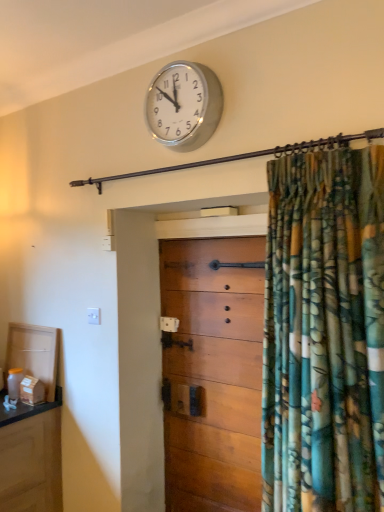
What is the approximate height of silver metallic clock at upper center?

33.89 centimeters.

This screenshot has height=512, width=384. What do you see at coordinates (184, 105) in the screenshot? I see `silver metallic clock at upper center` at bounding box center [184, 105].

Where is `silver metallic clock at upper center`? The width and height of the screenshot is (384, 512). silver metallic clock at upper center is located at coordinates (184, 105).

In order to face silver metallic clock at upper center, should I rotate leftwards or rightwards?

You should look left and rotate roughly 1.903 degrees.

Locate an element on the screen. This screenshot has width=384, height=512. wooden chest of drawers at center is located at coordinates (213, 373).

The height and width of the screenshot is (512, 384). What do you see at coordinates (213, 373) in the screenshot? I see `wooden chest of drawers at center` at bounding box center [213, 373].

Locate an element on the screen. Image resolution: width=384 pixels, height=512 pixels. silver metallic clock at upper center is located at coordinates (184, 105).

Would you say silver metallic clock at upper center is to the left or to the right of wooden chest of drawers at center in the picture?

In the image, silver metallic clock at upper center appears on the left side of wooden chest of drawers at center.

Looking at this image, which object is further away from the camera, silver metallic clock at upper center or wooden chest of drawers at center?

Positioned behind is wooden chest of drawers at center.

Is point (181, 85) farther from viewer compared to point (204, 472)?

No.

Consider the image. From the image's perspective, which is below, silver metallic clock at upper center or wooden chest of drawers at center?

wooden chest of drawers at center is shown below in the image.

From a real-world perspective, which is physically below, silver metallic clock at upper center or wooden chest of drawers at center?

From a 3D spatial view, wooden chest of drawers at center is below.

Based on the photo, can you confirm if silver metallic clock at upper center is thinner than wooden chest of drawers at center?

Yes, silver metallic clock at upper center is thinner than wooden chest of drawers at center.

Does silver metallic clock at upper center have a lesser height compared to wooden chest of drawers at center?

Indeed, silver metallic clock at upper center has a lesser height compared to wooden chest of drawers at center.

Considering the sizes of objects silver metallic clock at upper center and wooden chest of drawers at center in the image provided, who is bigger, silver metallic clock at upper center or wooden chest of drawers at center?

With larger size is wooden chest of drawers at center.

Is silver metallic clock at upper center completely or partially outside of wooden chest of drawers at center?

That's correct, silver metallic clock at upper center is outside of wooden chest of drawers at center.

Is silver metallic clock at upper center positioned far away from wooden chest of drawers at center?

No, silver metallic clock at upper center is in close proximity to wooden chest of drawers at center.

Is silver metallic clock at upper center oriented away from wooden chest of drawers at center?

No.

What's the angular difference between silver metallic clock at upper center and wooden chest of drawers at center's facing directions?

There is a 0.888-degree angle between the facing directions of silver metallic clock at upper center and wooden chest of drawers at center.

In the image, there is a wooden chest of drawers at center. Identify the location of wall clock above it (from the image's perspective). pyautogui.click(x=184, y=105).

Can you confirm if wooden chest of drawers at center is positioned to the right of silver metallic clock at upper center?

Yes.

Is wooden chest of drawers at center positioned before silver metallic clock at upper center?

No, the depth of wooden chest of drawers at center is greater than that of silver metallic clock at upper center.

Does point (181, 495) lie behind point (179, 100)?

Yes, it is behind point (179, 100).

From the image's perspective, between wooden chest of drawers at center and silver metallic clock at upper center, who is located below?

wooden chest of drawers at center appears lower in the image.

From a real-world perspective, who is located higher, wooden chest of drawers at center or silver metallic clock at upper center?

In real-world perspective, silver metallic clock at upper center is above.

Considering the relative sizes of wooden chest of drawers at center and silver metallic clock at upper center in the image provided, is wooden chest of drawers at center thinner than silver metallic clock at upper center?

No, wooden chest of drawers at center is not thinner than silver metallic clock at upper center.

Considering the sizes of wooden chest of drawers at center and silver metallic clock at upper center in the image, is wooden chest of drawers at center taller or shorter than silver metallic clock at upper center?

Clearly, wooden chest of drawers at center is taller compared to silver metallic clock at upper center.

Does wooden chest of drawers at center have a larger size compared to silver metallic clock at upper center?

Yes.

Can we say wooden chest of drawers at center lies outside silver metallic clock at upper center?

→ Yes.

Are wooden chest of drawers at center and silver metallic clock at upper center making contact?

No, wooden chest of drawers at center is not touching silver metallic clock at upper center.

Is wooden chest of drawers at center aimed at silver metallic clock at upper center?

No, wooden chest of drawers at center is not aimed at silver metallic clock at upper center.

Looking at this image, how many degrees apart are the facing directions of wooden chest of drawers at center and silver metallic clock at upper center?

wooden chest of drawers at center and silver metallic clock at upper center are facing 0.888 degrees away from each other.

Where is `chest of drawers that appears on the right of silver metallic clock at upper center`? The image size is (384, 512). chest of drawers that appears on the right of silver metallic clock at upper center is located at coordinates [x=213, y=373].

Locate an element on the screen. chest of drawers below the silver metallic clock at upper center (from the image's perspective) is located at coordinates (213, 373).

Locate an element on the screen. The image size is (384, 512). wall clock above the wooden chest of drawers at center (from the image's perspective) is located at coordinates (184, 105).